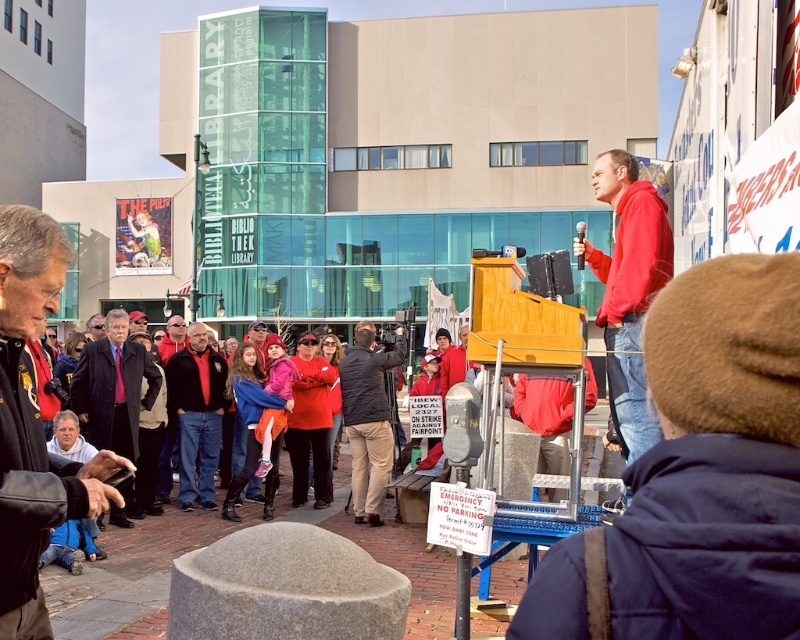
Is black leather jacket at lower left thinner than khaki pants at center?

Yes, black leather jacket at lower left is thinner than khaki pants at center.

Which is behind, point (18, 502) or point (344, 404)?

The point (344, 404) is more distant.

The height and width of the screenshot is (640, 800). I want to click on black leather jacket at lower left, so click(x=34, y=424).

Does point (30, 600) come farther from viewer compared to point (165, 433)?

No, it is not.

Does black leather jacket at lower left have a greater width compared to red fabric jacket at center?

In fact, black leather jacket at lower left might be narrower than red fabric jacket at center.

Is point (14, 323) behind point (169, 392)?

No.

At what (x,y) coordinates should I click in order to perform the action: click on black leather jacket at lower left. Please return your answer as a coordinate pair (x, y). The image size is (800, 640). Looking at the image, I should click on (34, 424).

Between point (178, 400) and point (370, 454), which one is positioned in front?

Point (370, 454)

Does point (176, 365) come behind point (376, 428)?

That is True.

You are a GUI agent. You are given a task and a screenshot of the screen. Output one action in this format:
    pyautogui.click(x=<x>, y=<y>)
    Task: Click on the red jacket at center
    The image size is (800, 640).
    Given the screenshot: What is the action you would take?
    pyautogui.click(x=196, y=413)